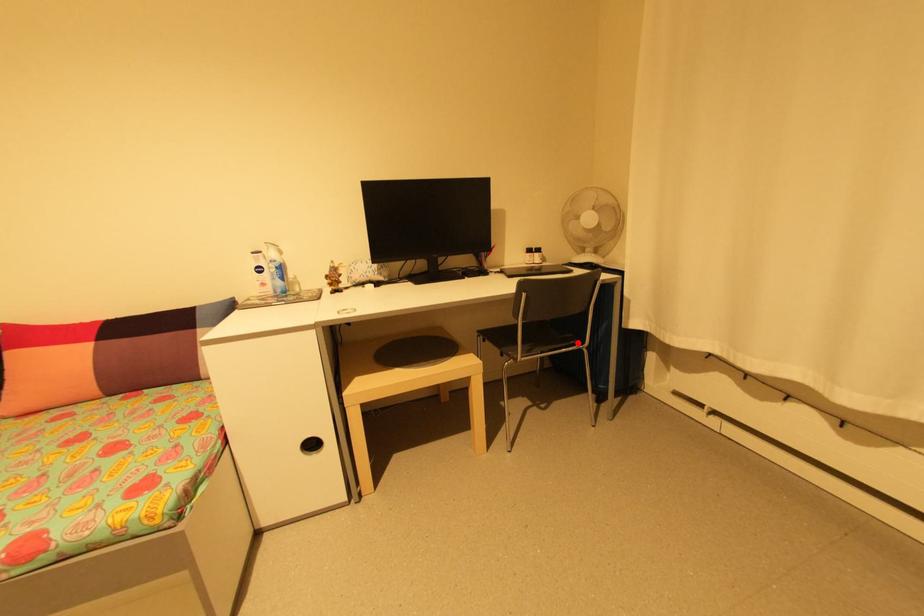
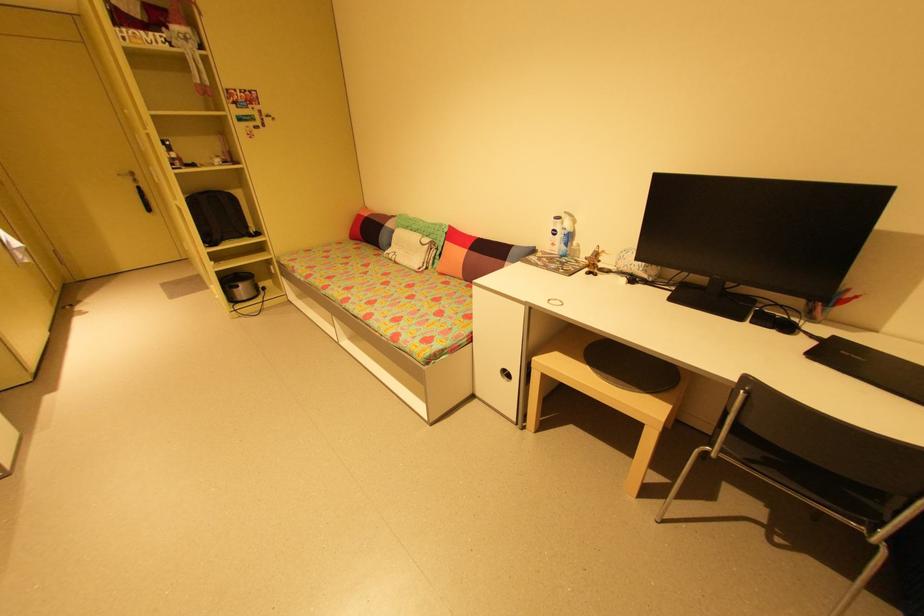
The point at the highlighted location is marked in the first image. Where is the corresponding point in the second image?

(869, 519)